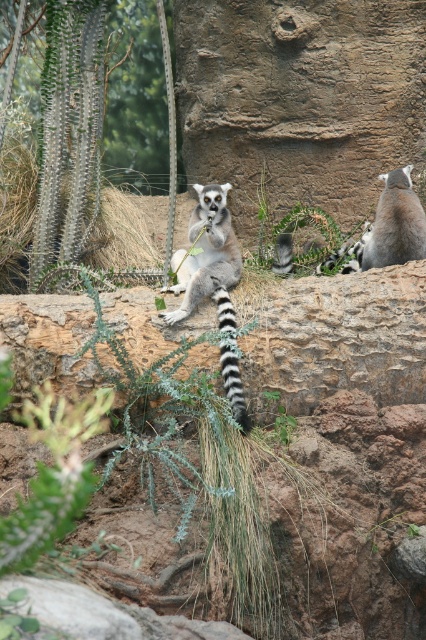
Question: Which point appears farthest from the camera in this image?

Choices:
 (A) (120, 3)
 (B) (382, 243)

Answer: (A)

Question: Which point is closer to the camera?

Choices:
 (A) (37, 72)
 (B) (230, 317)
 (C) (382, 220)

Answer: (B)

Question: Which point appears closest to the camera in this image?

Choices:
 (A) (388, 172)
 (B) (20, 84)

Answer: (A)

Question: Is green spiky cactus at upper left to the right of ring-tailed lemur at upper right from the viewer's perspective?

Choices:
 (A) no
 (B) yes

Answer: (A)

Question: Can you confirm if green spiky cactus at upper left is positioned above ring-tailed lemur at center?

Choices:
 (A) no
 (B) yes

Answer: (B)

Question: Considering the relative positions of green spiky cactus at upper left and ring-tailed lemur at upper right in the image provided, where is green spiky cactus at upper left located with respect to ring-tailed lemur at upper right?

Choices:
 (A) right
 (B) left

Answer: (B)